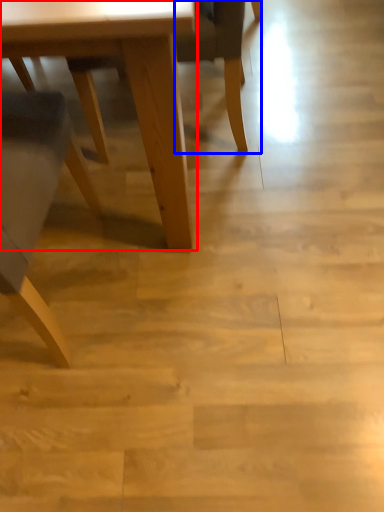
Question: Which object appears closest to the camera in this image, table (highlighted by a red box) or chair (highlighted by a blue box)?

Choices:
 (A) table
 (B) chair

Answer: (A)